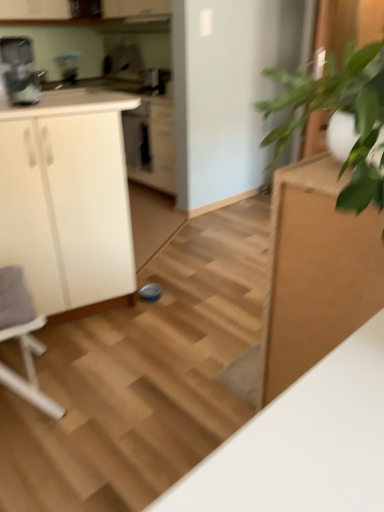
Question: Is green leafy plant at right at the left side of wooden stair at center?

Choices:
 (A) yes
 (B) no

Answer: (B)

Question: Does green leafy plant at right lie in front of wooden stair at center?

Choices:
 (A) no
 (B) yes

Answer: (B)

Question: From the image's perspective, would you say green leafy plant at right is positioned over wooden stair at center?

Choices:
 (A) no
 (B) yes

Answer: (B)

Question: Is wooden stair at center completely or partially inside green leafy plant at right?

Choices:
 (A) yes
 (B) no

Answer: (B)

Question: Is green leafy plant at right positioned with its back to wooden stair at center?

Choices:
 (A) no
 (B) yes

Answer: (A)

Question: Looking at their shapes, would you say metallic silver coffee machine at upper left is wider or thinner than white plastic rocking chair at left?

Choices:
 (A) thin
 (B) wide

Answer: (A)

Question: Is metallic silver coffee machine at upper left inside the boundaries of white plastic rocking chair at left, or outside?

Choices:
 (A) inside
 (B) outside

Answer: (B)

Question: From the image's perspective, is metallic silver coffee machine at upper left positioned above or below white plastic rocking chair at left?

Choices:
 (A) below
 (B) above

Answer: (B)

Question: Considering their positions, is metallic silver coffee machine at upper left located in front of or behind white plastic rocking chair at left?

Choices:
 (A) front
 (B) behind

Answer: (B)

Question: Is point (104, 160) closer or farther from the camera than point (94, 483)?

Choices:
 (A) farther
 (B) closer

Answer: (A)

Question: Is white matte cabinet at left in front of or behind wooden stair at center in the image?

Choices:
 (A) front
 (B) behind

Answer: (B)

Question: Is white matte cabinet at left wider or thinner than wooden stair at center?

Choices:
 (A) thin
 (B) wide

Answer: (A)

Question: Considering the positions of white matte cabinet at left and wooden stair at center in the image, is white matte cabinet at left bigger or smaller than wooden stair at center?

Choices:
 (A) big
 (B) small

Answer: (B)

Question: Relative to green leafy plant at right, is white plastic rocking chair at left in front or behind?

Choices:
 (A) behind
 (B) front

Answer: (A)

Question: Would you say white plastic rocking chair at left is to the left or to the right of green leafy plant at right in the picture?

Choices:
 (A) right
 (B) left

Answer: (B)